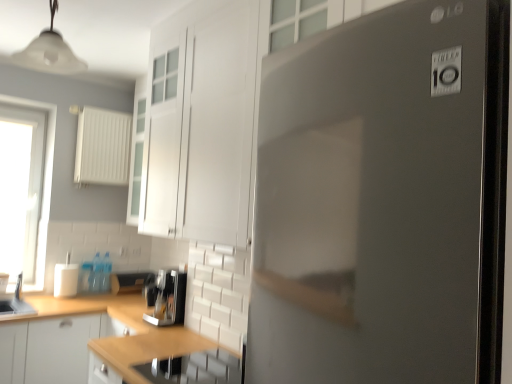
Question: Considering the positions of stainless steel sink at lower center, acting as the 3th appliance starting from the back, and white glossy cabinet at upper center, marked as the 2th cabinetry in a back-to-front arrangement, in the image, is stainless steel sink at lower center, acting as the 3th appliance starting from the back, wider or thinner than white glossy cabinet at upper center, marked as the 2th cabinetry in a back-to-front arrangement,?

Choices:
 (A) thin
 (B) wide

Answer: (B)

Question: In terms of size, does stainless steel sink at lower center, which is the 1th appliance from right to left, appear bigger or smaller than white glossy cabinet at upper center, marked as the 2th cabinetry in a back-to-front arrangement?

Choices:
 (A) big
 (B) small

Answer: (B)

Question: Which object is positioned farthest from the transparent glass window at left?

Choices:
 (A) satin black fridge at center
 (B) wooden countertop at lower center
 (C) white plastic radiator at upper left, which is the 2th appliance from right to left
 (D) stainless steel sink at lower center, which is the 1th appliance from right to left
 (E) sleek metallic coffee maker at center

Answer: (A)

Question: Which object is the closest to the transparent glass window at left?

Choices:
 (A) white glossy cup at lower left, the second appliance positioned from the front
 (B) white plastic radiator at upper left, the 1th appliance viewed from the back
 (C) white glossy cabinet at upper center, the 1th cabinetry viewed from the top
 (D) white matte cabinet at lower left, which ranks as the 2th cabinetry in top-to-bottom order
 (E) wooden countertop at lower center

Answer: (B)